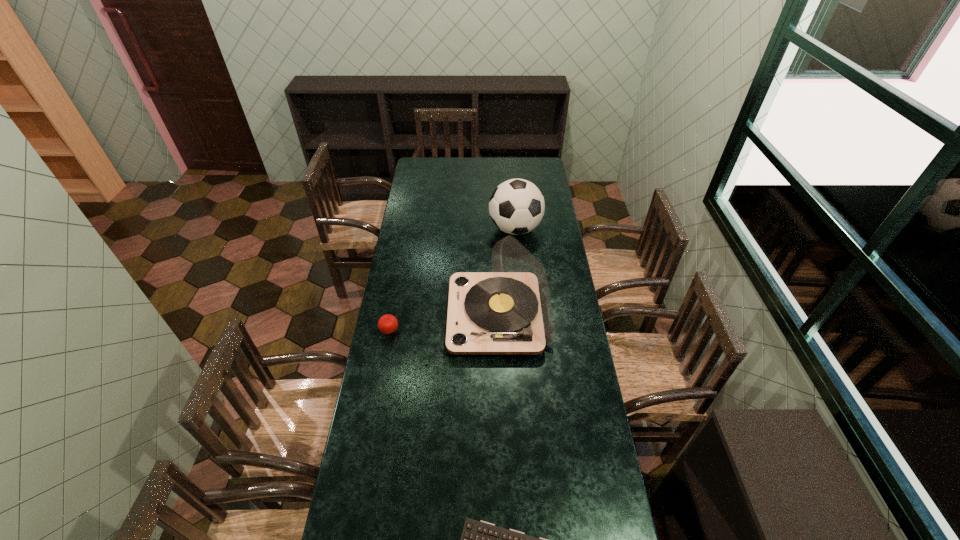
The image size is (960, 540). Identify the location of record player. (508, 311).

Locate an element on the screen. soccer ball is located at coordinates (516, 206).

Identify the location of the farthest object. (516, 206).

Find the location of a particular element. Image resolution: width=960 pixels, height=540 pixels. apple is located at coordinates click(x=387, y=324).

This screenshot has width=960, height=540. Find the location of `the leftmost object`. the leftmost object is located at coordinates (387, 324).

What are the coordinates of `free space located 0.190m with the tonearm facing the front of the tallest object` in the screenshot? It's located at 404,316.

I want to click on free region located with the tonearm facing the front of the tallest object, so (x=437, y=316).

Locate an element on the screen. free space located 0.250m with the tonearm facing the front of the tallest object is located at coordinates (391, 316).

Where is `free spot located on the front of the soccer ball`? free spot located on the front of the soccer ball is located at coordinates (519, 273).

Where is `vacant space situated 0.190m on the right of the second shortest object`? The image size is (960, 540). vacant space situated 0.190m on the right of the second shortest object is located at coordinates (444, 332).